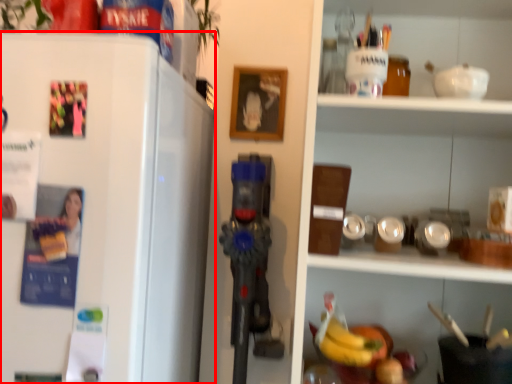
Question: Considering the relative positions of refrigerator (annotated by the red box) and shelf in the image provided, where is refrigerator (annotated by the red box) located with respect to the staircase?

Choices:
 (A) left
 (B) right

Answer: (A)